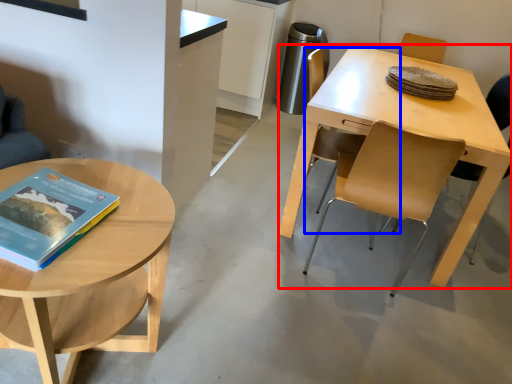
Question: Among these objects, which one is nearest to the camera, desk (highlighted by a red box) or chair (highlighted by a blue box)?

Choices:
 (A) desk
 (B) chair

Answer: (A)